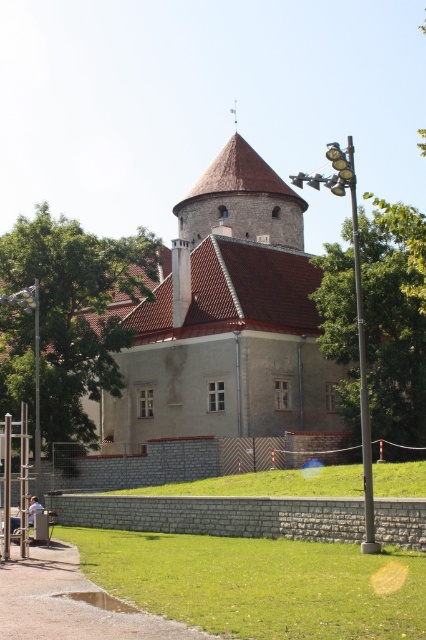
Question: Which of the following is the farthest from the observer?

Choices:
 (A) (242, 237)
 (B) (5, 577)

Answer: (A)

Question: Can you confirm if gray stone castle at center is smaller than green grass at lower center?

Choices:
 (A) yes
 (B) no

Answer: (B)

Question: Does gray stone castle at center appear on the left side of green grass at lower center?

Choices:
 (A) no
 (B) yes

Answer: (A)

Question: Where is gray stone castle at center located in relation to green grass at lower center in the image?

Choices:
 (A) left
 (B) right

Answer: (B)